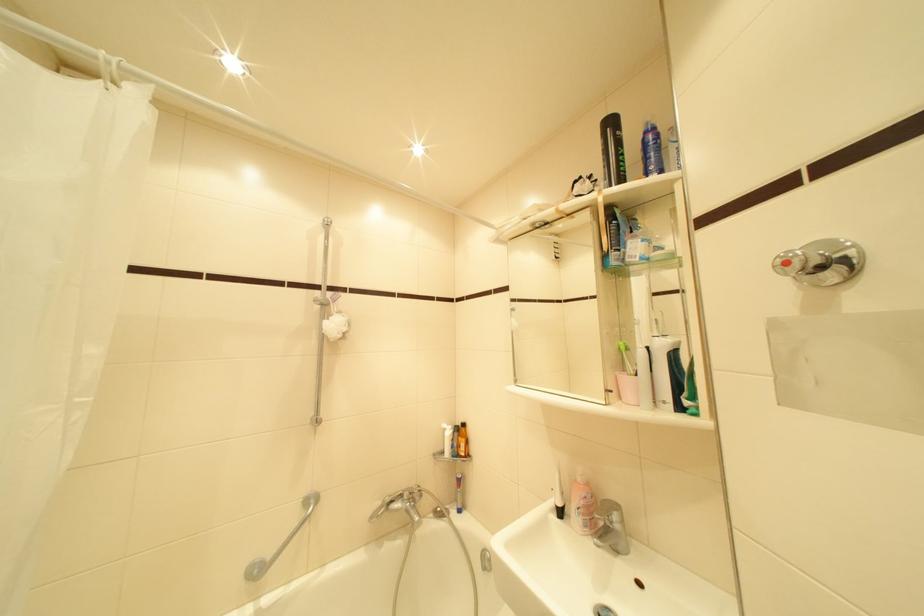
Where is `pink soap dispenser`? The width and height of the screenshot is (924, 616). pink soap dispenser is located at coordinates (581, 505).